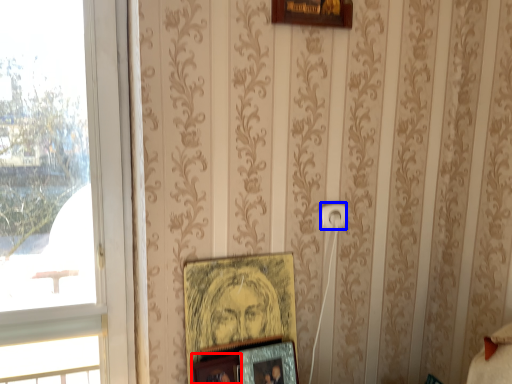
Question: Which object is further to the camera taking this photo, picture frame (highlighted by a red box) or electric outlet (highlighted by a blue box)?

Choices:
 (A) picture frame
 (B) electric outlet

Answer: (B)